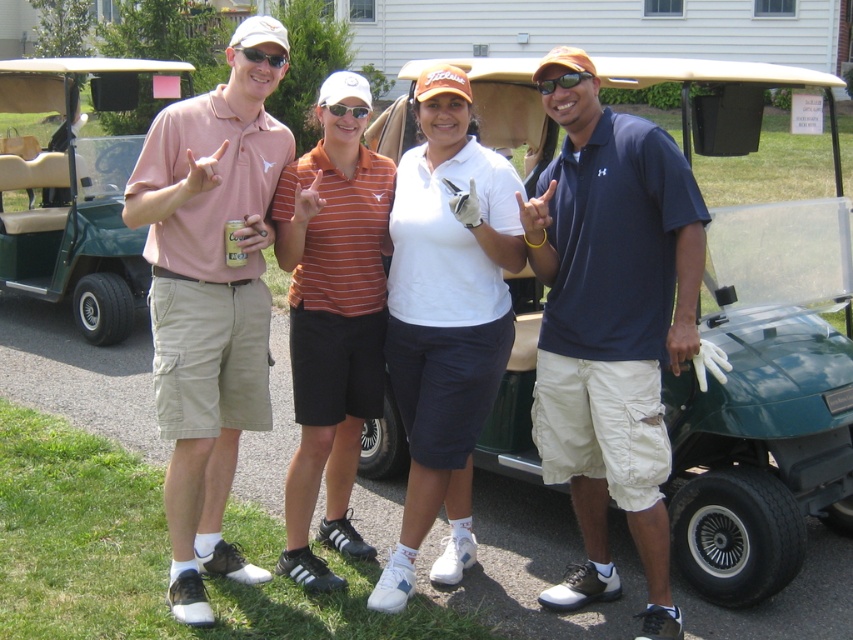
Question: Which is farther from the matte black sunglasses at upper center?

Choices:
 (A) orange striped polo shirt at center
 (B) black plastic sunglasses at upper center
 (C) green matte golf cart at left

Answer: (C)

Question: Which point appears farthest from the camera in this image?

Choices:
 (A) (282, 246)
 (B) (548, 328)
 (C) (363, 115)

Answer: (A)

Question: Is matte pink polo shirt at left wider than white matte golf glove at center?

Choices:
 (A) yes
 (B) no

Answer: (A)

Question: Among these objects, which one is nearest to the camera?

Choices:
 (A) white plastic goggles at center
 (B) black plastic sunglasses at upper center

Answer: (B)

Question: Is green matte golf cart at center closer to the viewer compared to black plastic sunglasses at upper center?

Choices:
 (A) yes
 (B) no

Answer: (B)

Question: Is orange striped polo shirt at center to the left of matte black sunglasses at upper center from the viewer's perspective?

Choices:
 (A) no
 (B) yes

Answer: (A)